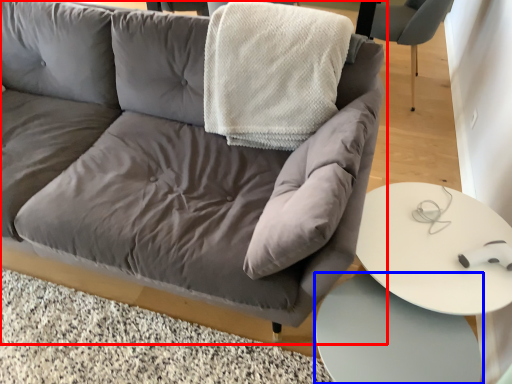
Question: Which point is closer to the camera, studio couch (highlighted by a red box) or table (highlighted by a blue box)?

Choices:
 (A) studio couch
 (B) table

Answer: (A)